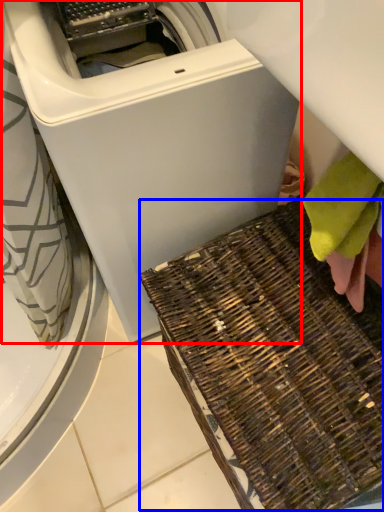
Question: Which object appears closest to the camera in this image, washing machine (highlighted by a red box) or waste (highlighted by a blue box)?

Choices:
 (A) washing machine
 (B) waste

Answer: (A)